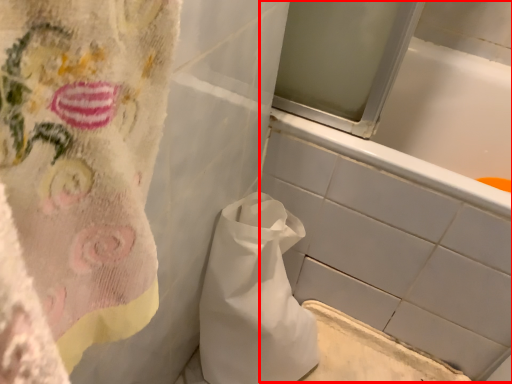
Question: In this image, where is bath (annotated by the red box) located relative to paper bag?

Choices:
 (A) left
 (B) right

Answer: (B)